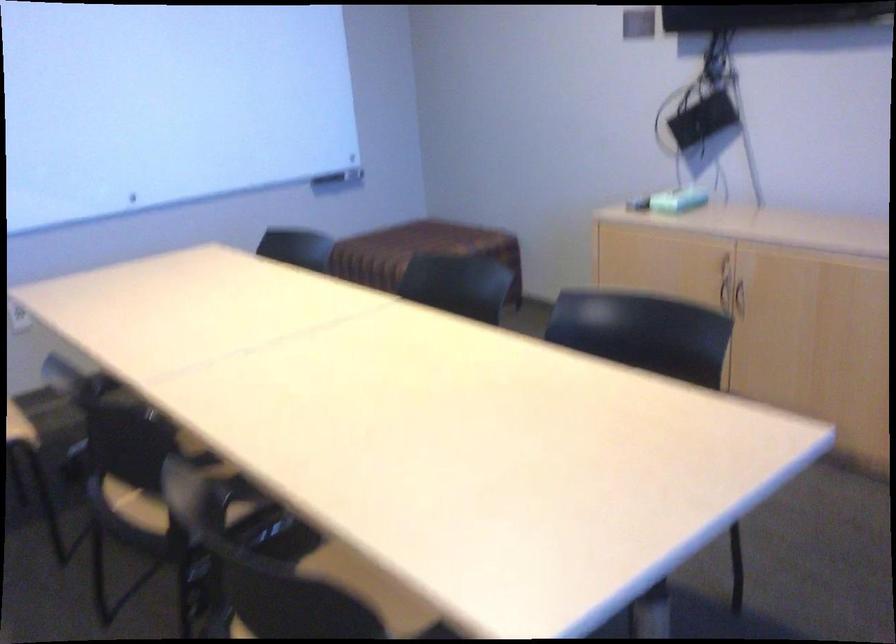
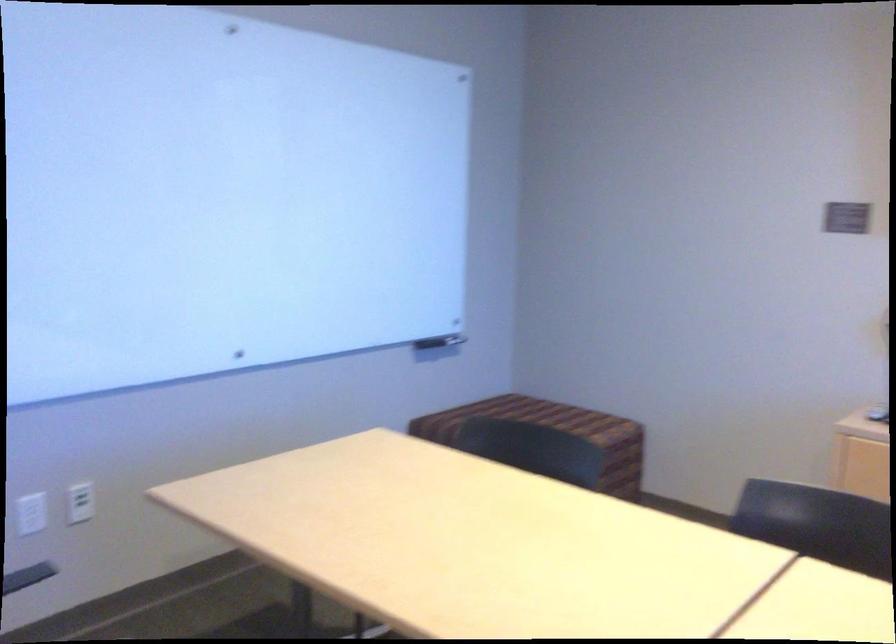
In a continuous first-person perspective shot, in which direction is the camera moving?

The cameraman moved toward left, forward.